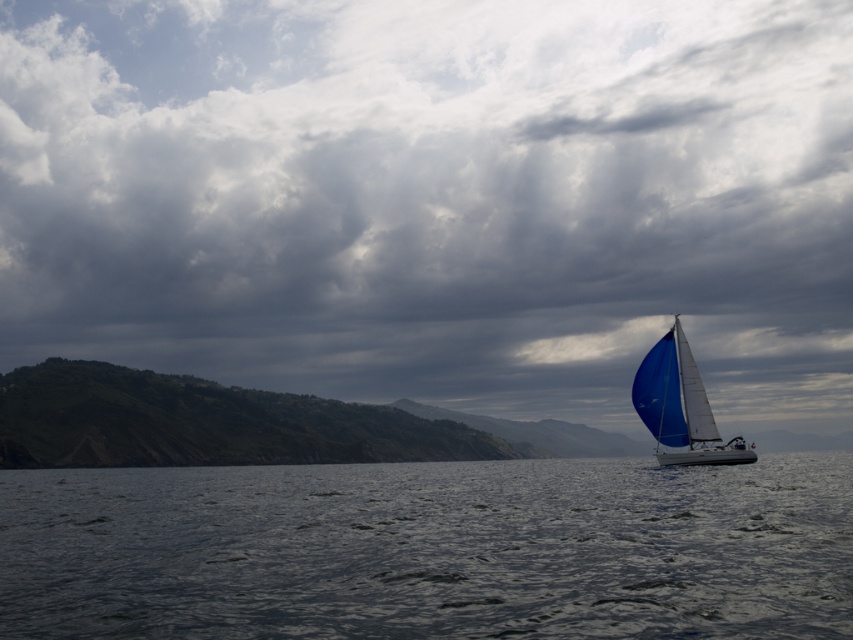
Between dark blue water at lower center and blue sailboat at right, which one is positioned higher?

blue sailboat at right

Which is behind, point (759, 490) or point (712, 440)?

The point (712, 440) is behind.

The image size is (853, 640). I want to click on dark blue water at lower center, so click(x=431, y=548).

Which is below, cloudy sky at upper center or blue sailboat at right?

blue sailboat at right is lower down.

Image resolution: width=853 pixels, height=640 pixels. Identify the location of cloudy sky at upper center. (436, 198).

Identify the location of cloudy sky at upper center. (436, 198).

This screenshot has height=640, width=853. What do you see at coordinates (436, 198) in the screenshot?
I see `cloudy sky at upper center` at bounding box center [436, 198].

Is point (160, 92) positioned before point (300, 624)?

No, it is behind (300, 624).

At what (x,y) coordinates should I click in order to perform the action: click on cloudy sky at upper center. Please return your answer as a coordinate pair (x, y). Image resolution: width=853 pixels, height=640 pixels. Looking at the image, I should click on point(436,198).